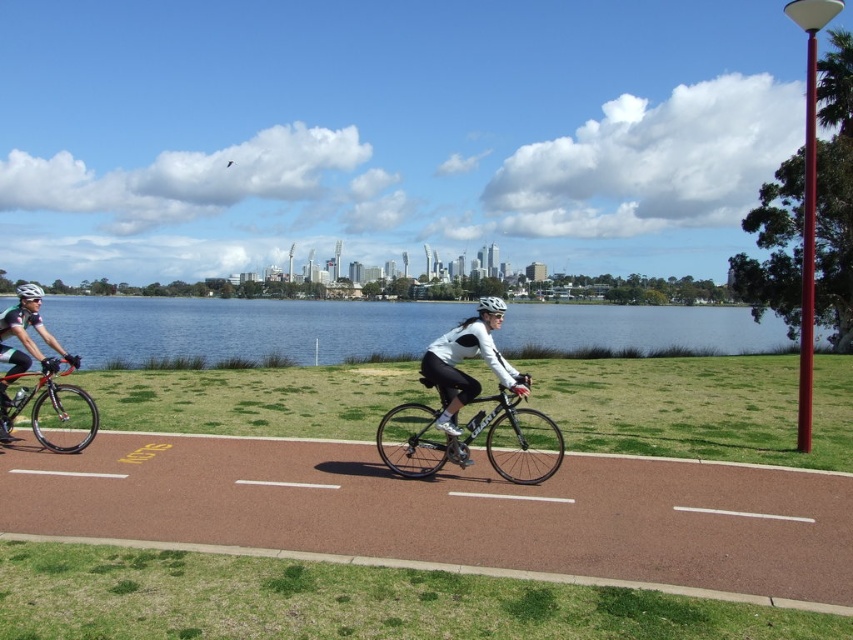
You are a cyclist trying to cross the blue water at center. There is a shiny black bike at center in your path. Can you safely pass around it?

The shiny black bike at center is behind the blue water at center, so you can safely pass around it as the bike is not blocking your path to the blue water.

You are a cyclist trying to follow the path in the image. You see two points marked on the path ahead. The first point is at coordinates point (70, 298) and the second is at point (386, 413). Which point should you aim to reach first while moving forward along the path?

You should aim to reach point (386, 413) first because point (70, 298) is behind it, meaning the second point is closer to your current position as you move forward.